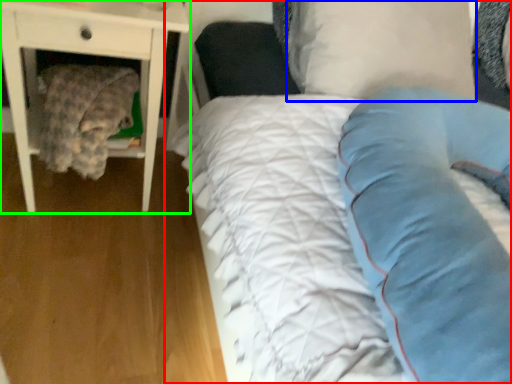
Question: Considering the real-world distances, which object is farthest from bed (highlighted by a red box)? pillow (highlighted by a blue box) or nightstand (highlighted by a green box)?

Choices:
 (A) pillow
 (B) nightstand

Answer: (B)